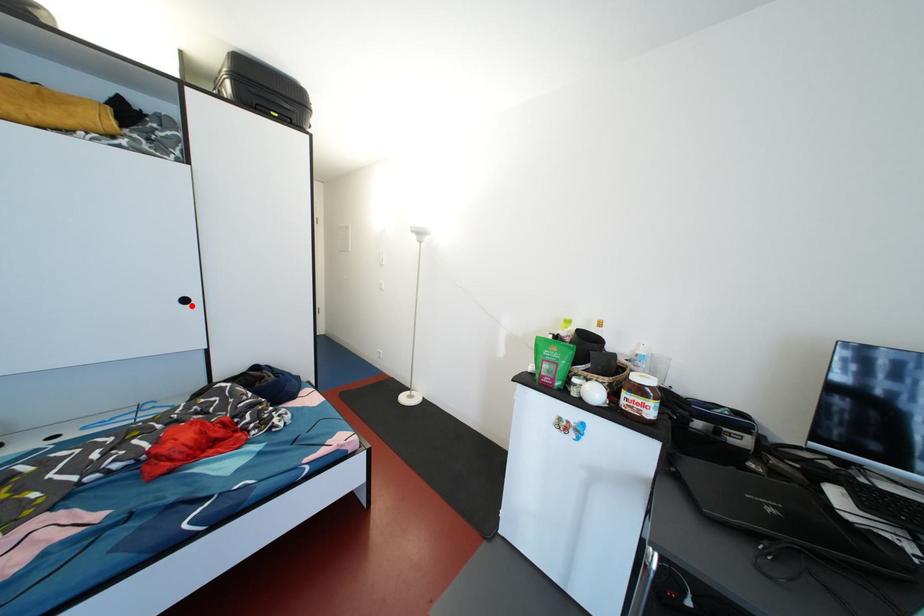
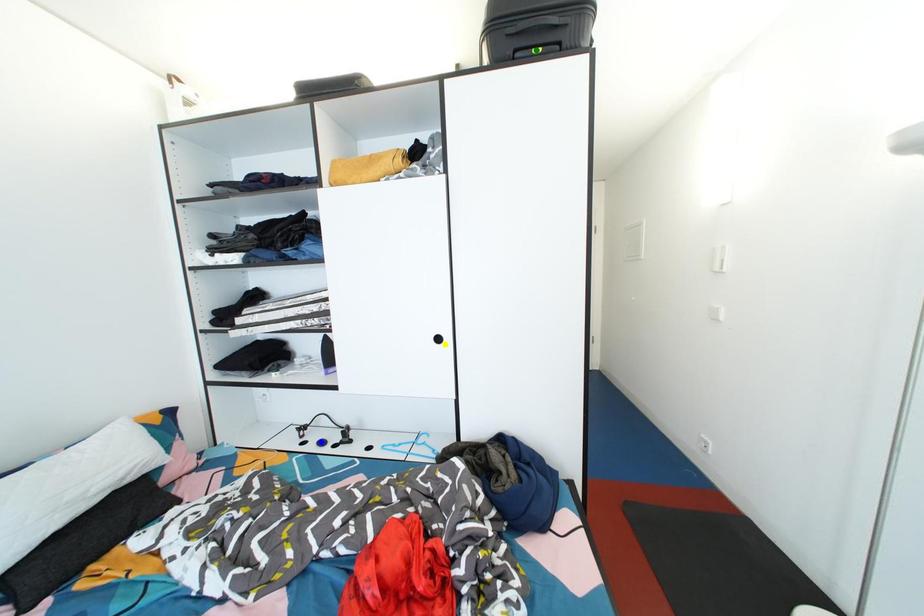
Question: I am providing you with two images of the same scene from different viewpoints. A red point is marked on the first image. You are given multiple points on the second image. Can you choose the point in image 2 that corresponds to the point in image 1?

Choices:
 (A) green point
 (B) blue point
 (C) yellow point

Answer: (C)